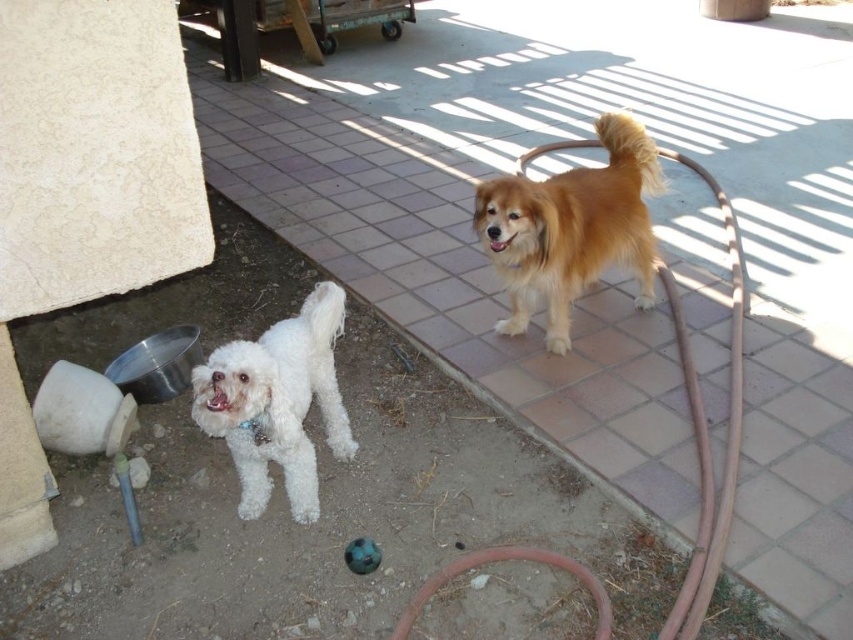
You are standing at the center of the image. Which direction should you move to reach the white fluffy dog at lower left?

You should move to the lower left direction to reach the white fluffy dog at lower left since it is located at point (277, 403).

You are a gardener who needs to water the plants near the white fluffy dog at lower left and the rubber hose at lower center. The hose is fully extended. Can you reach the dog with the hose without moving either?

The white fluffy dog at lower left is 24.31 inches from the rubber hose at lower center. Since the hose is fully extended, it may not be long enough to reach the dog unless the hose length exceeds 24.31 inches. However, since the exact hose length isn not provided, we can only state the distance between them.